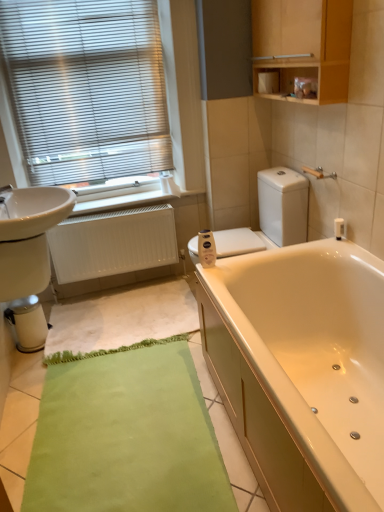
The image size is (384, 512). Find the location of `blank space situated above white matte radiator at lower left (from a real-world perspective)`. blank space situated above white matte radiator at lower left (from a real-world perspective) is located at coordinates (120, 213).